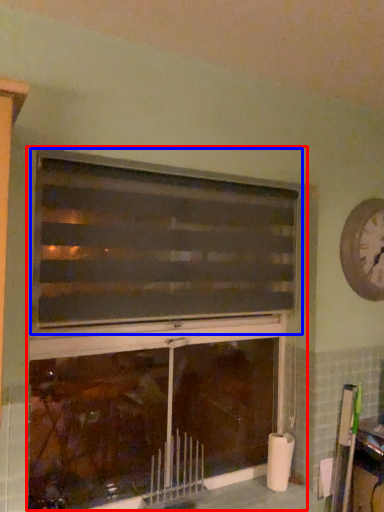
Question: Which object appears farthest to the camera in this image, fireplace (highlighted by a red box) or window (highlighted by a blue box)?

Choices:
 (A) fireplace
 (B) window

Answer: (A)